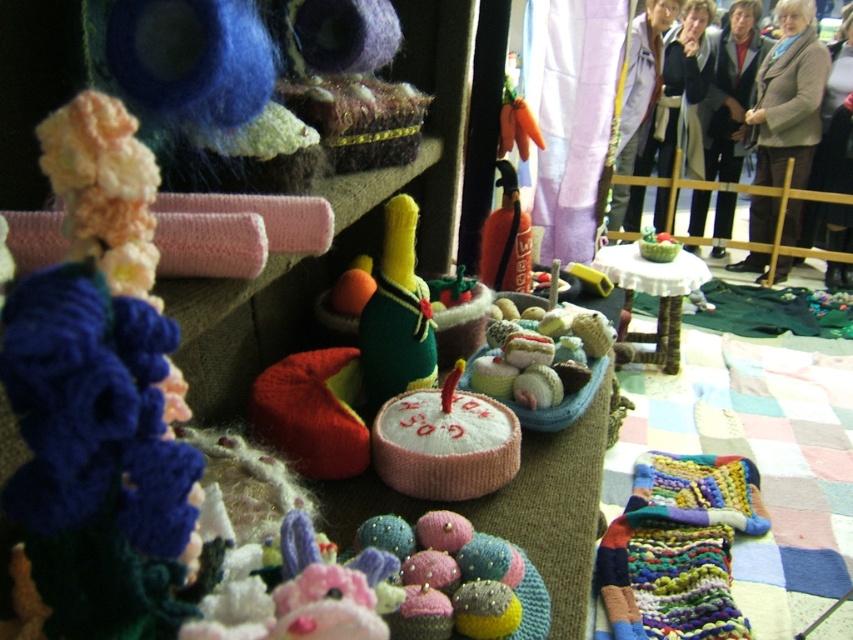
Question: Which point is farther to the camera?

Choices:
 (A) knitted beige sweater at center
 (B) gray wool coat at upper right

Answer: (B)

Question: Can you confirm if multicolored knitted scarf at lower right is wider than green felt toy at center?

Choices:
 (A) no
 (B) yes

Answer: (B)

Question: Which point appears farthest from the camera in this image?

Choices:
 (A) (416, 465)
 (B) (787, 157)

Answer: (B)

Question: Is knitted yarn toy at left smaller than gray wool coat at upper right?

Choices:
 (A) yes
 (B) no

Answer: (A)

Question: Does knitted yarn toy at left appear on the right side of multicolored knitted scarf at lower right?

Choices:
 (A) yes
 (B) no

Answer: (B)

Question: Which point is farther to the camera?

Choices:
 (A) (634, 145)
 (B) (693, 272)
 (C) (149, 621)

Answer: (A)